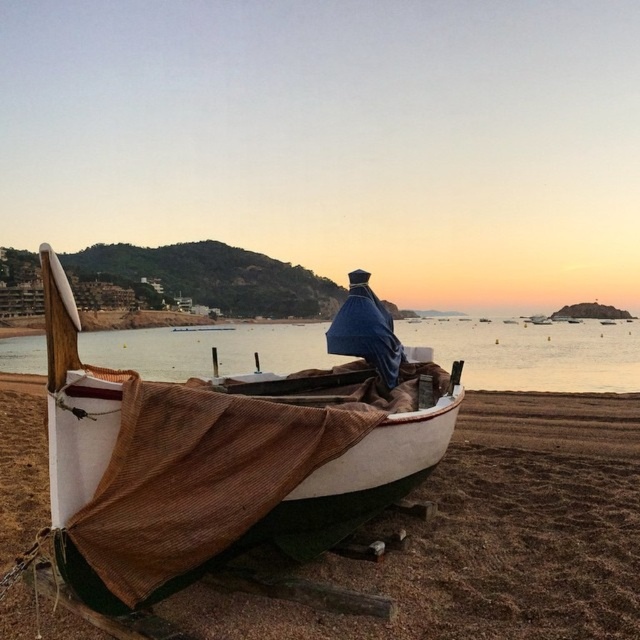
You are a photographer standing at the edge of the beach, and you want to take a photo that includes both the brown sand at lower center and the blue fabric at center. If your camera has a maximum focus range of 7 feet, will you be able to capture both objects in focus without moving your position?

The brown sand at lower center and blue fabric at center are 7.56 feet apart from each other. Since the distance between them exceeds the camera maximum focus range of 7 feet, you will not be able to capture both objects in focus without moving your position.

You are standing on the beach and looking at the wooden boat. There are two points marked on the boat. One is at coordinate point (x=499, y=380) and the other is at point (x=400, y=348). Which point is closer to you?

Point (x=499, y=380) is further to the viewer than point (x=400, y=348), so the point at (x=400, y=348) is closer to you.